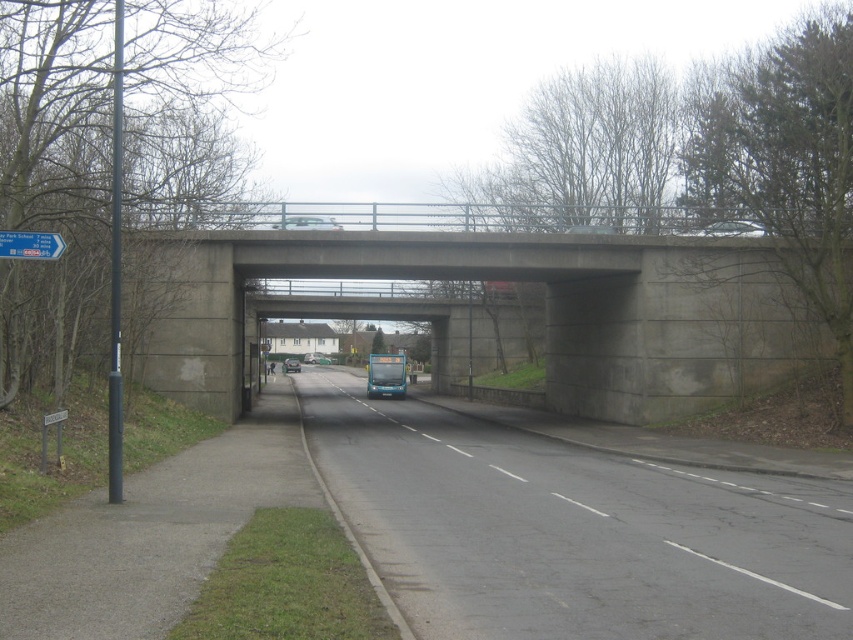
Question: Based on their relative distances, which object is farther from the concrete bridge at center?

Choices:
 (A) black asphalt highway at center
 (B) silver metallic car at center
 (C) metallic silver car at center

Answer: (C)

Question: Which point is farther from the camera taking this photo?

Choices:
 (A) (369, 396)
 (B) (282, 364)

Answer: (B)

Question: Is black asphalt highway at center to the right of teal glossy bus at center from the viewer's perspective?

Choices:
 (A) yes
 (B) no

Answer: (A)

Question: Is blue plastic sign at upper left below silver metallic car at center?

Choices:
 (A) no
 (B) yes

Answer: (B)

Question: Based on their relative distances, which object is farther from the black asphalt highway at center?

Choices:
 (A) teal glossy bus at center
 (B) metallic silver car at center

Answer: (B)

Question: Does teal glossy bus at center have a larger size compared to metallic silver car at center?

Choices:
 (A) no
 (B) yes

Answer: (A)